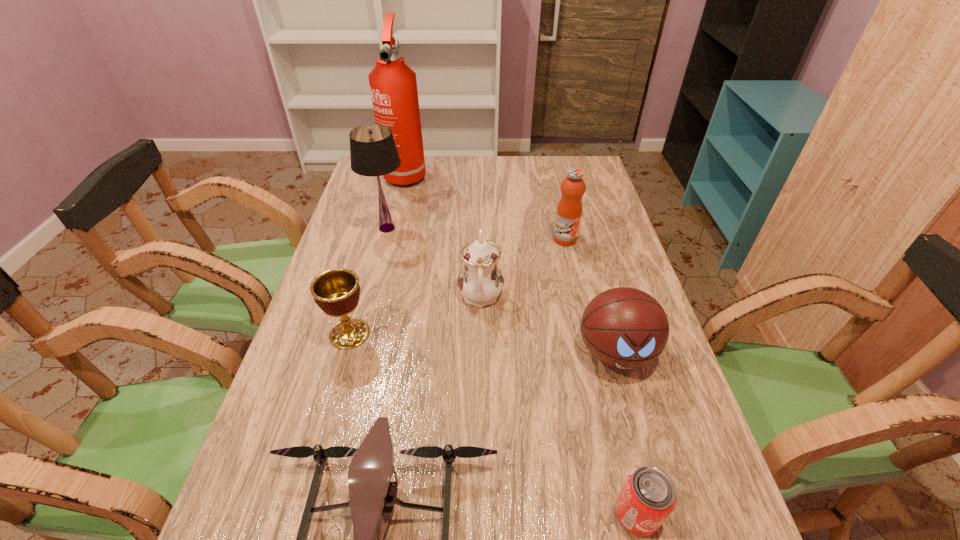
You are a GUI agent. You are given a task and a screenshot of the screen. Output one action in this format:
    pyautogui.click(x=<x>, y=<y>)
    Task: Click on the vacant space located on the front label of the fruit juice
    This screenshot has height=540, width=960.
    Given the screenshot: What is the action you would take?
    pyautogui.click(x=580, y=307)

Where is `vacant space located 0.320m on the back of the chinaware`? Image resolution: width=960 pixels, height=540 pixels. vacant space located 0.320m on the back of the chinaware is located at coordinates (480, 208).

Locate an element on the screen. free region located 0.230m on the back of the basketball is located at coordinates (591, 264).

The height and width of the screenshot is (540, 960). Identify the location of vacant space located 0.250m on the right of the chalice. (472, 334).

Locate an element on the screen. This screenshot has height=540, width=960. vacant space located on the left of the shortest object is located at coordinates (559, 514).

Find the location of `object that is at the far edge`. object that is at the far edge is located at coordinates [393, 85].

I want to click on fire extinguisher that is positioned at the left edge, so click(393, 85).

This screenshot has height=540, width=960. In order to click on lampshade that is at the left edge in this screenshot , I will do `click(373, 152)`.

The image size is (960, 540). I want to click on chalice located at the left edge, so click(x=336, y=291).

This screenshot has height=540, width=960. In order to click on fruit juice that is at the right edge in this screenshot , I will do `click(569, 209)`.